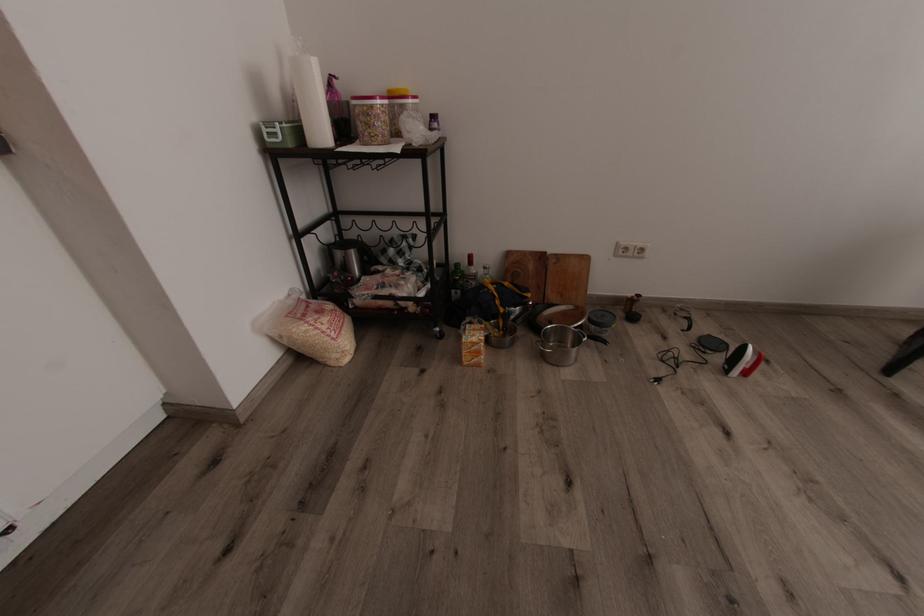
You are a GUI agent. You are given a task and a screenshot of the screen. Output one action in this format:
    pyautogui.click(x=<x>, y=<y>)
    Task: Click on the small juice carton
    This screenshot has height=616, width=924.
    Given the screenshot: What is the action you would take?
    pyautogui.click(x=371, y=119)